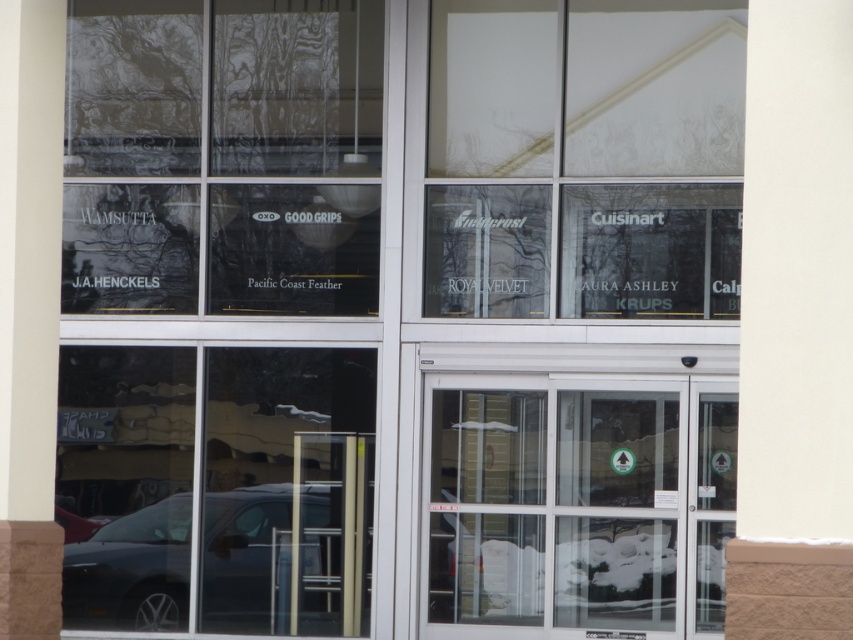
You are standing in front of the building and notice two points on the glass storefront. The first point is at coordinates point (352, 244) and the second is at point (172, 516). Which point appears closer to you?

Point (352, 244) is closer to the viewer than point (172, 516).

You are a delivery person standing in front of the building and want to place a package on the white frosted glass at upper center. Can you confirm the exact coordinates where you should place it?

The white frosted glass at upper center is located at point (585, 157), so you should place the package at those coordinates.